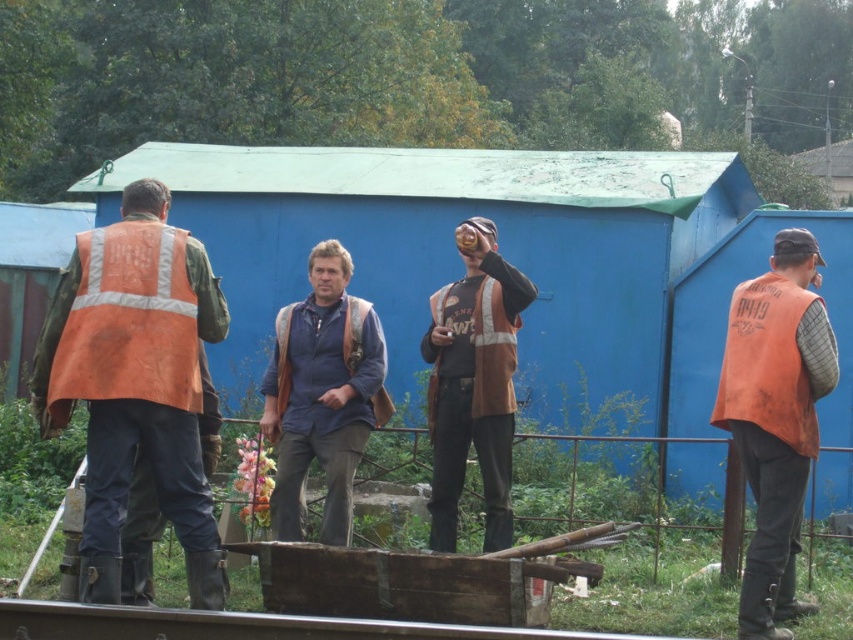
Question: Can you confirm if orange reflective safety vest at center is thinner than orange fabric safety vest at center?

Choices:
 (A) yes
 (B) no

Answer: (B)

Question: Based on their relative distances, which object is farther from the orange reflective vest at right?

Choices:
 (A) brown leather jacket at center
 (B) orange reflective vest at left
 (C) orange fabric safety vest at center

Answer: (B)

Question: Is orange reflective safety vest at left smaller than orange reflective safety vest at center?

Choices:
 (A) no
 (B) yes

Answer: (A)

Question: Which is farther from the brown leather jacket at center?

Choices:
 (A) orange reflective vest at left
 (B) orange reflective vest at right
 (C) orange reflective safety vest at center
 (D) blue denim shirt at center

Answer: (A)

Question: Which point is farther from the camera taking this photo?

Choices:
 (A) (328, 492)
 (B) (352, 346)
 (C) (509, 378)

Answer: (C)

Question: Does orange reflective safety vest at left appear on the right side of orange fabric safety vest at center?

Choices:
 (A) yes
 (B) no

Answer: (B)